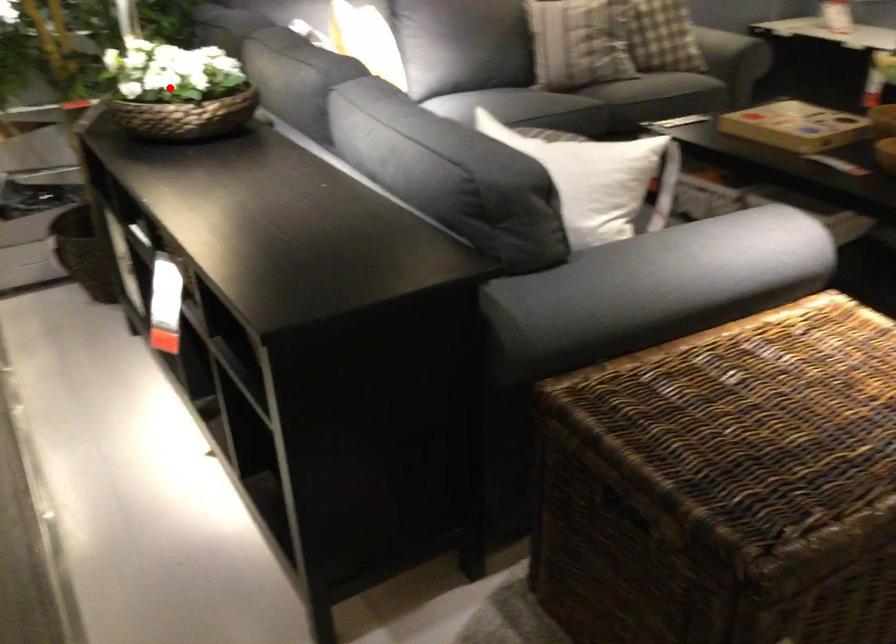
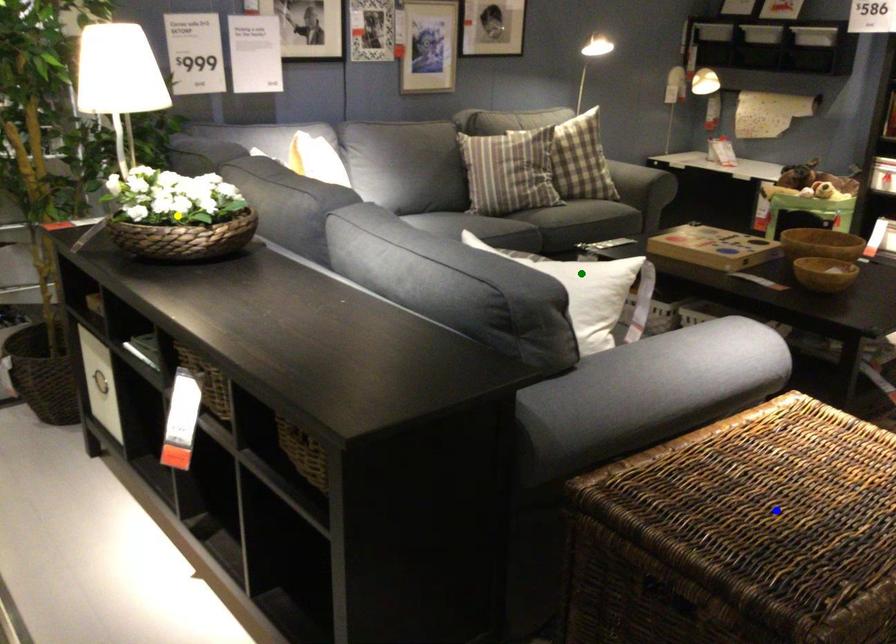
Question: I am providing you with two images of the same scene from different viewpoints. A red point is marked on the first image. You are given multiple points on the second image. Which mark in image 2 goes with the point in image 1?

Choices:
 (A) green point
 (B) yellow point
 (C) blue point

Answer: (B)